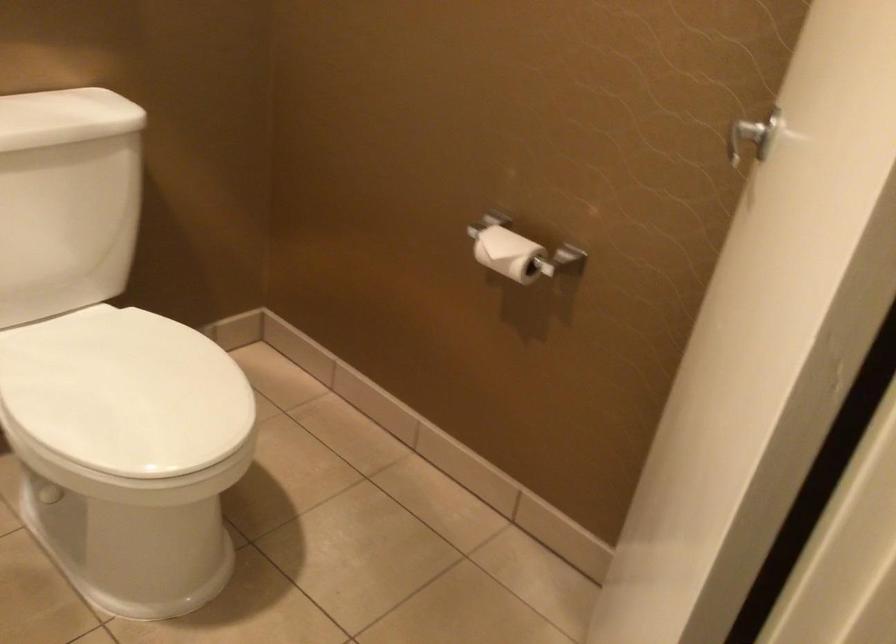
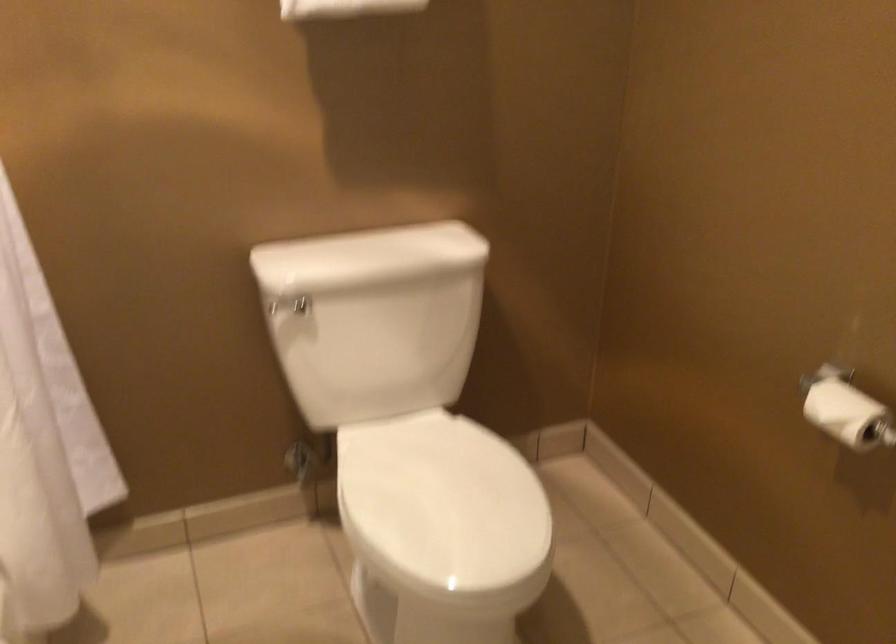
Question: The camera is either moving clockwise (left) or counter-clockwise (right) around the object. The first image is from the beginning of the video and the second image is from the end. Is the camera moving left or right when shooting the video?

Choices:
 (A) Left
 (B) Right

Answer: (B)